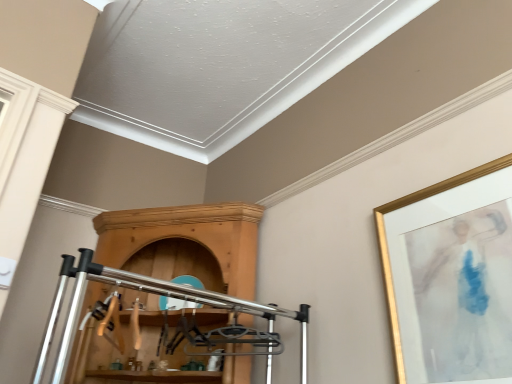
The width and height of the screenshot is (512, 384). What do you see at coordinates (451, 277) in the screenshot?
I see `gold-framed artwork at upper right` at bounding box center [451, 277].

Where is `gold-framed artwork at upper right`? gold-framed artwork at upper right is located at coordinates (451, 277).

Measure the distance between point (495, 279) and camera.

Point (495, 279) is 1.25 meters away from camera.

Locate an element on the screen. This screenshot has height=384, width=512. wooden cabinet at center is located at coordinates (185, 244).

This screenshot has width=512, height=384. Describe the element at coordinates (185, 244) in the screenshot. I see `wooden cabinet at center` at that location.

From the picture: In order to face wooden cabinet at center, should I rotate leftwards or rightwards?

Rotate your view left by about 11.037°.

You are a GUI agent. You are given a task and a screenshot of the screen. Output one action in this format:
    pyautogui.click(x=<x>, y=<y>)
    Task: Click on the gold-framed artwork at upper right
    
    Given the screenshot: What is the action you would take?
    pyautogui.click(x=451, y=277)

In the image, is gold-framed artwork at upper right on the left side or the right side of wooden cabinet at center?

Based on their positions, gold-framed artwork at upper right is located to the right of wooden cabinet at center.

Who is more distant, gold-framed artwork at upper right or wooden cabinet at center?

wooden cabinet at center is further away from the camera.

Which point is more distant from viewer, (x=476, y=295) or (x=220, y=253)?

Positioned behind is point (x=220, y=253).

From the image's perspective, relative to wooden cabinet at center, is gold-framed artwork at upper right above or below?

Clearly, from the image's perspective, gold-framed artwork at upper right is above wooden cabinet at center.

From a real-world perspective, does gold-framed artwork at upper right sit lower than wooden cabinet at center?

Yes, from a real-world perspective, gold-framed artwork at upper right is under wooden cabinet at center.

Can you confirm if gold-framed artwork at upper right is wider than wooden cabinet at center?

Incorrect, the width of gold-framed artwork at upper right does not surpass that of wooden cabinet at center.

Considering the sizes of objects gold-framed artwork at upper right and wooden cabinet at center in the image provided, who is shorter, gold-framed artwork at upper right or wooden cabinet at center?

gold-framed artwork at upper right.

Considering the relative sizes of gold-framed artwork at upper right and wooden cabinet at center in the image provided, is gold-framed artwork at upper right smaller than wooden cabinet at center?

Yes.

Is gold-framed artwork at upper right located outside wooden cabinet at center?

Yes, gold-framed artwork at upper right is outside of wooden cabinet at center.

Is gold-framed artwork at upper right touching wooden cabinet at center?

No, gold-framed artwork at upper right is not with wooden cabinet at center.

Could you tell me if gold-framed artwork at upper right is facing wooden cabinet at center?

No, gold-framed artwork at upper right is not facing towards wooden cabinet at center.

Based on the photo, what's the angular difference between gold-framed artwork at upper right and wooden cabinet at center's facing directions?

The angle between the facing direction of gold-framed artwork at upper right and the facing direction of wooden cabinet at center is 38.1 degrees.

At what (x,y) coordinates should I click in order to perform the action: click on furniture to the left of gold-framed artwork at upper right. Please return your answer as a coordinate pair (x, y). Looking at the image, I should click on (185, 244).

Between wooden cabinet at center and gold-framed artwork at upper right, which one appears on the right side from the viewer's perspective?

gold-framed artwork at upper right.

Relative to gold-framed artwork at upper right, is wooden cabinet at center in front or behind?

wooden cabinet at center is behind gold-framed artwork at upper right.

Which is behind, point (81, 358) or point (410, 316)?

The point (81, 358) is behind.

From the image's perspective, is wooden cabinet at center on gold-framed artwork at upper right?

No, from the image's perspective, wooden cabinet at center is not above gold-framed artwork at upper right.

From a real-world perspective, does wooden cabinet at center stand above gold-framed artwork at upper right?

Yes, from a real-world perspective, wooden cabinet at center is over gold-framed artwork at upper right

Which of these two, wooden cabinet at center or gold-framed artwork at upper right, is wider?

wooden cabinet at center.

Can you confirm if wooden cabinet at center is taller than gold-framed artwork at upper right?

Yes, wooden cabinet at center is taller than gold-framed artwork at upper right.

Does wooden cabinet at center have a larger size compared to gold-framed artwork at upper right?

Yes.

Is wooden cabinet at center situated inside gold-framed artwork at upper right or outside?

wooden cabinet at center cannot be found inside gold-framed artwork at upper right.

Is wooden cabinet at center far from gold-framed artwork at upper right?

Absolutely, wooden cabinet at center is distant from gold-framed artwork at upper right.

Could you tell me if wooden cabinet at center is facing gold-framed artwork at upper right?

→ No, wooden cabinet at center is not facing towards gold-framed artwork at upper right.

How many degrees apart are the facing directions of wooden cabinet at center and gold-framed artwork at upper right?

They differ by 38.1 degrees in their facing directions.

Measure the distance from wooden cabinet at center to gold-framed artwork at upper right.

They are 1.03 meters apart.

At what (x,y) coordinates should I click in order to perform the action: click on furniture above the gold-framed artwork at upper right (from a real-world perspective). Please return your answer as a coordinate pair (x, y). Looking at the image, I should click on coord(185,244).

Where is `picture frame that is under the wooden cabinet at center (from a real-world perspective)`? picture frame that is under the wooden cabinet at center (from a real-world perspective) is located at coordinates (451, 277).

The height and width of the screenshot is (384, 512). I want to click on picture frame above the wooden cabinet at center (from the image's perspective), so click(451, 277).